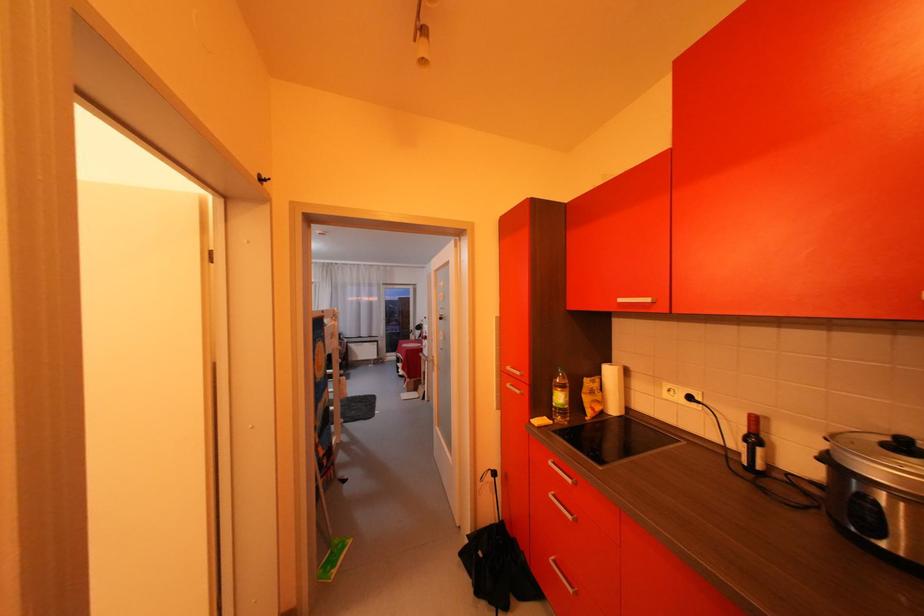
The height and width of the screenshot is (616, 924). Identify the location of black wall hook. (261, 177).